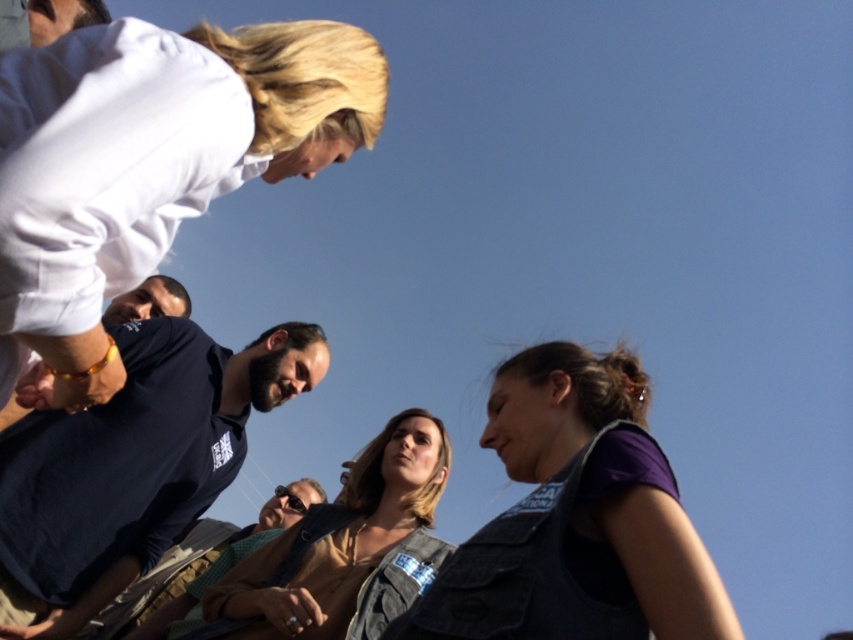
Question: Considering the relative positions of denim vest at lower right and green checkered shirt at center in the image provided, where is denim vest at lower right located with respect to green checkered shirt at center?

Choices:
 (A) above
 (B) below

Answer: (A)

Question: Which point is farther to the camera?

Choices:
 (A) (334, 611)
 (B) (277, 97)

Answer: (A)

Question: Which point is farther from the camera taking this photo?

Choices:
 (A) (155, 282)
 (B) (531, 589)
 (C) (196, 624)
 (D) (270, 147)

Answer: (A)

Question: Considering the real-world distances, which object is farthest from the green checkered shirt at center?

Choices:
 (A) dark blue shirt at lower left
 (B) white matte shirt at upper left
 (C) denim jacket at center
 (D) dark brown hair at upper right

Answer: (D)

Question: Is denim vest at lower right positioned in front of green checkered shirt at center?

Choices:
 (A) no
 (B) yes

Answer: (B)

Question: Can you confirm if denim jacket at center is thinner than dark brown hair at upper right?

Choices:
 (A) yes
 (B) no

Answer: (B)